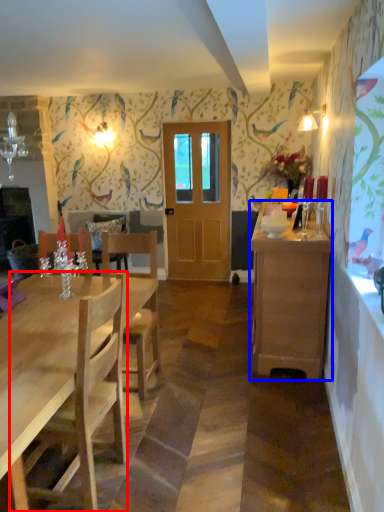
Question: Among these objects, which one is farthest to the camera, chair (highlighted by a red box) or cabinetry (highlighted by a blue box)?

Choices:
 (A) chair
 (B) cabinetry

Answer: (B)